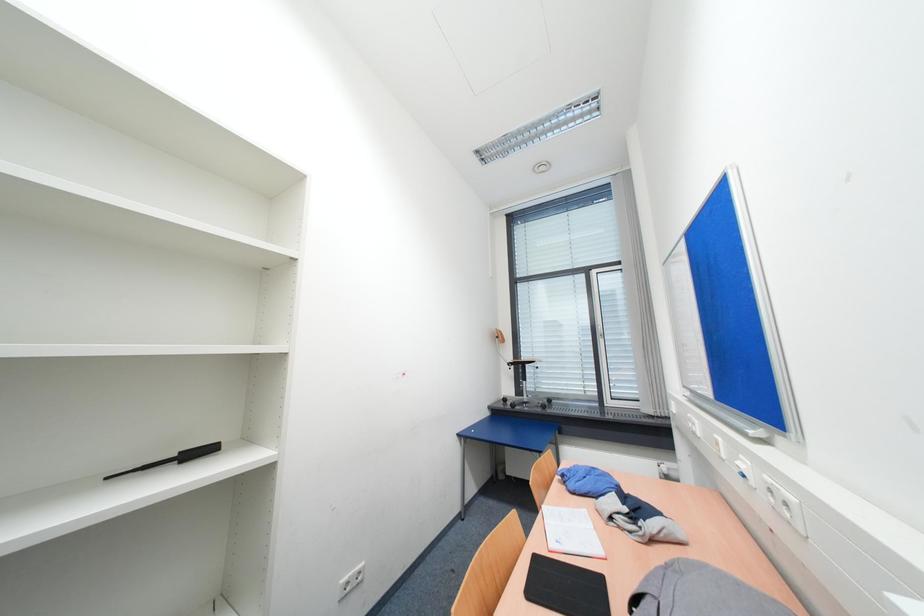
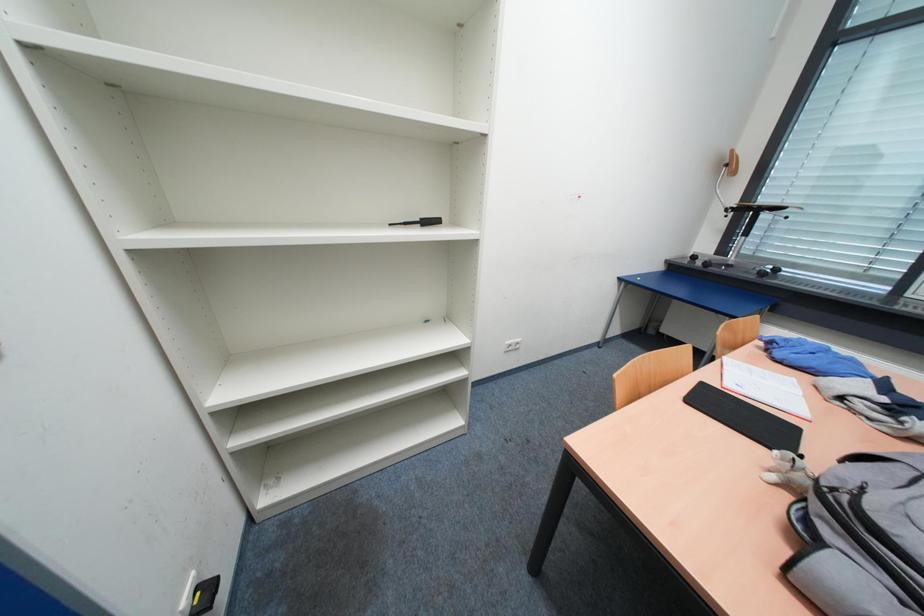
First-person continuous shooting, in which direction is the camera rotating?

The camera's rotation is toward left-down.